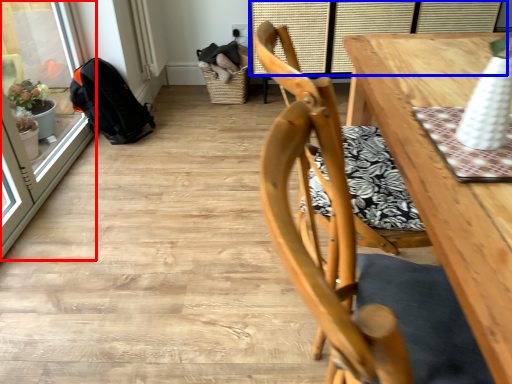
Question: Which of the following is the farthest to the observer, screen door (highlighted by a red box) or window (highlighted by a blue box)?

Choices:
 (A) screen door
 (B) window

Answer: (B)